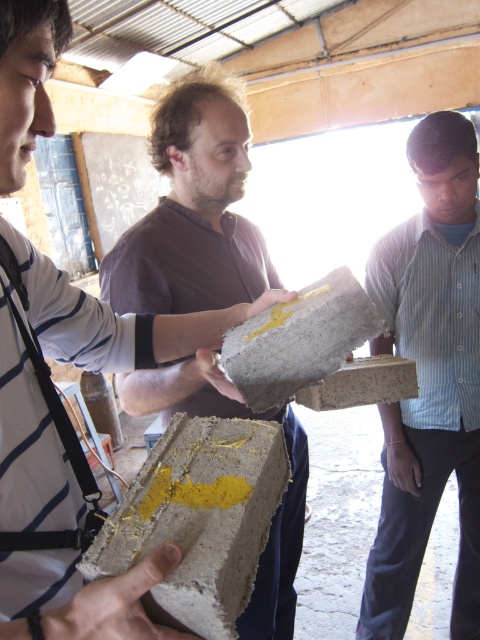
Does matte concrete block at center have a lesser height compared to concrete block at center?

No.

Image resolution: width=480 pixels, height=640 pixels. Describe the element at coordinates (192, 209) in the screenshot. I see `matte concrete block at center` at that location.

At what (x,y) coordinates should I click in order to perform the action: click on matte concrete block at center. Please return your answer as a coordinate pair (x, y). Image resolution: width=480 pixels, height=640 pixels. Looking at the image, I should click on (192, 209).

Image resolution: width=480 pixels, height=640 pixels. In order to click on matte concrete block at center in this screenshot , I will do `click(192, 209)`.

Is blue striped shirt at right below matte concrete block at center?

Yes.

Measure the distance from blue striped shirt at right to matte concrete block at center.

A distance of 18.01 inches exists between blue striped shirt at right and matte concrete block at center.

Is point (403, 493) in front of point (190, 397)?

That is False.

Identify the location of blue striped shirt at right. This screenshot has width=480, height=640. (429, 378).

Is blue striped shirt at right smaller than concrete block with yellow paint at center?

Incorrect, blue striped shirt at right is not smaller in size than concrete block with yellow paint at center.

Who is taller, blue striped shirt at right or concrete block with yellow paint at center?

With more height is blue striped shirt at right.

The image size is (480, 640). Find the location of `blue striped shirt at right`. blue striped shirt at right is located at coordinates (429, 378).